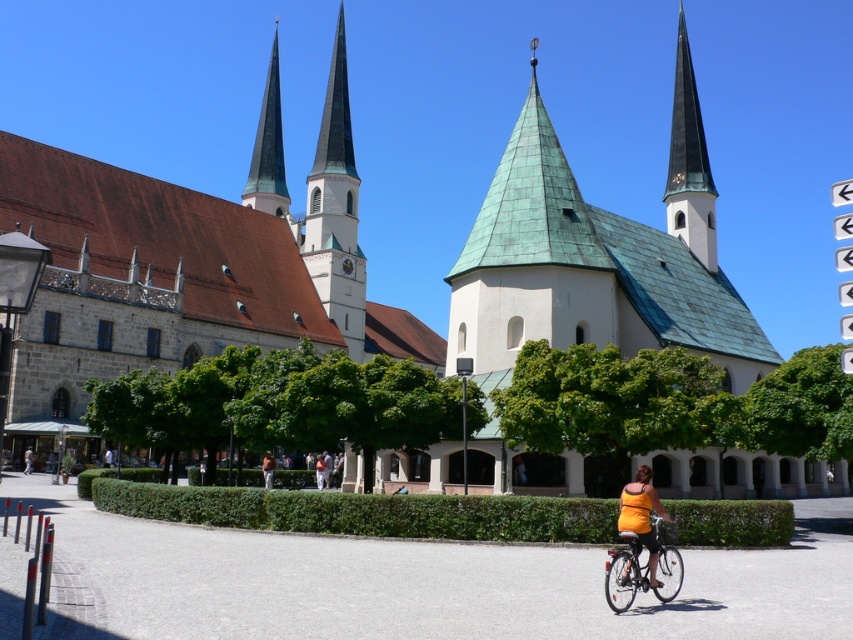
Question: Is green copper spire at center bigger than orange fabric bicycle at lower right?

Choices:
 (A) no
 (B) yes

Answer: (B)

Question: Among these objects, which one is nearest to the camera?

Choices:
 (A) orange fabric shirt at lower right
 (B) smooth white spire at upper right
 (C) orange fabric bicycle at lower right

Answer: (A)

Question: Which of the following is the farthest from the observer?

Choices:
 (A) orange fabric shirt at center
 (B) orange fabric bicycle at lower right
 (C) orange fabric shirt at lower right

Answer: (A)

Question: Is green copper spire at center closer to camera compared to orange fabric shirt at lower right?

Choices:
 (A) no
 (B) yes

Answer: (A)

Question: Considering the relative positions of orange fabric bicycle at lower right and orange t-shirt at lower center in the image provided, where is orange fabric bicycle at lower right located with respect to orange t-shirt at lower center?

Choices:
 (A) left
 (B) right

Answer: (B)

Question: Which point appears farthest from the camera in this image?

Choices:
 (A) (694, 216)
 (B) (258, 128)

Answer: (B)